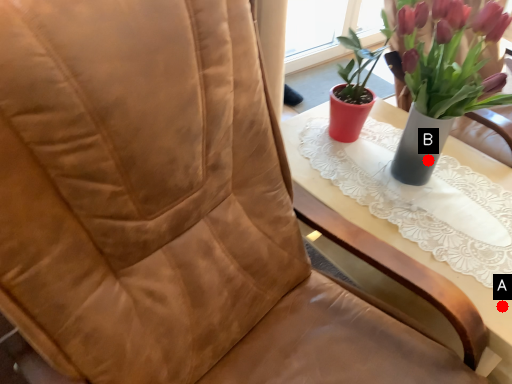
Question: Two points are circled on the image, labeled by A and B beside each circle. Which point is further to the camera?

Choices:
 (A) A is further
 (B) B is further

Answer: (B)